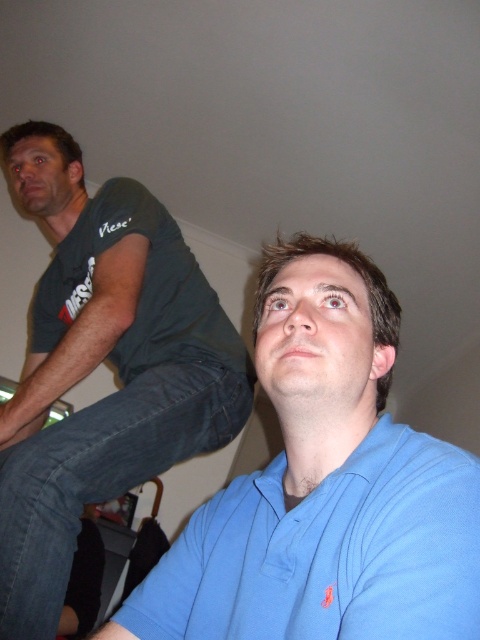
You are holding a 12 inch ruler and want to measure the distance between the blue cotton shirt at lower right and the camera. Can you fit the ruler horizontally to measure this distance?

The blue cotton shirt at lower right is 12.36 inches from the camera. Since the ruler is 12 inches long, it can fit horizontally to measure the distance as it is slightly shorter than the actual distance.